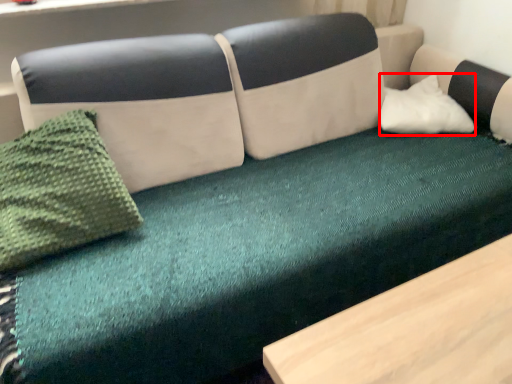
Question: From the image's perspective, where is pillow (annotated by the red box) located relative to throw pillow?

Choices:
 (A) below
 (B) above

Answer: (B)